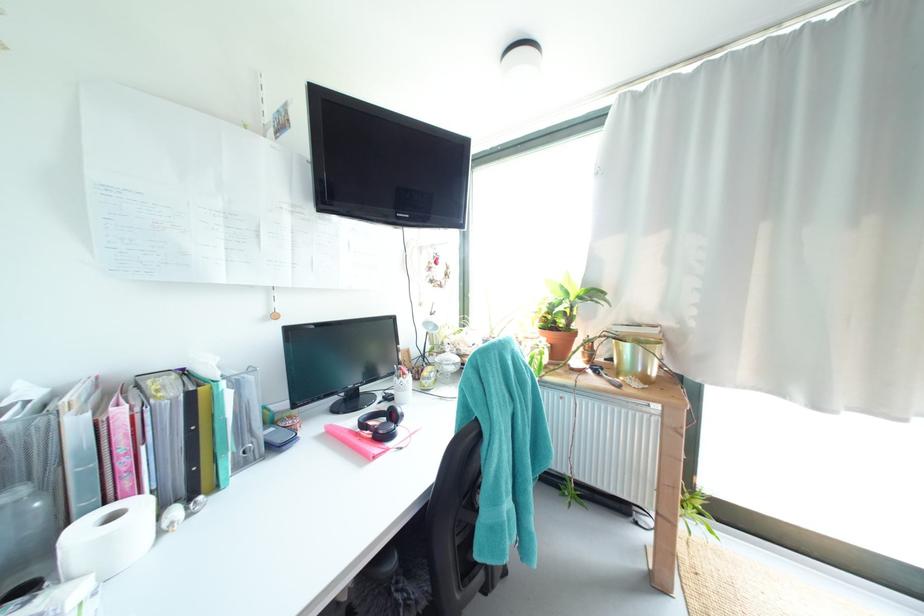
Image resolution: width=924 pixels, height=616 pixels. I want to click on glass jar lid, so click(446, 363).